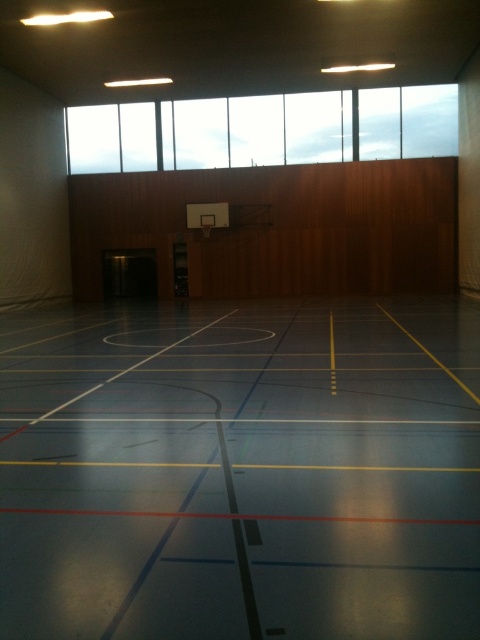
You are a basketball player standing at the center of the court. You want to check the time remaining on the scoreboard displayed on the transparent glass windows at upper center. Can you see the scoreboard through the metallic silver basketball hoop at center?

The transparent glass windows at upper center are located to the right of the metallic silver basketball hoop at center, so the scoreboard on the windows can be seen from the center of the court as the hoop does not block the view.

You are a basketball coach planning to install a new scoreboard. You have two options for placement based on the available space in the sports hall. The first option is to place it near the transparent glass windows at upper center, and the second is near the metallic silver basketball hoop at center. Considering the width of the spaces, which location would allow for a larger scoreboard?

The transparent glass windows at upper center have a larger width than the metallic silver basketball hoop at center, so placing the scoreboard near the transparent glass windows at upper center would allow for a larger scoreboard.